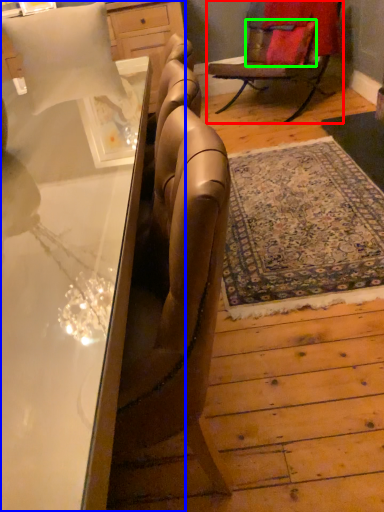
Question: Based on their relative distances, which object is nearer to chair (highlighted by a red box)? Choose from desk (highlighted by a blue box) and pillow (highlighted by a green box).

Choices:
 (A) desk
 (B) pillow

Answer: (B)